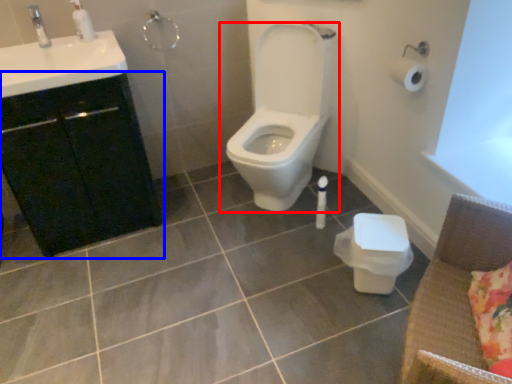
Question: Which of the following is the farthest to the observer, toilet (highlighted by a red box) or bathroom cabinet (highlighted by a blue box)?

Choices:
 (A) toilet
 (B) bathroom cabinet

Answer: (A)